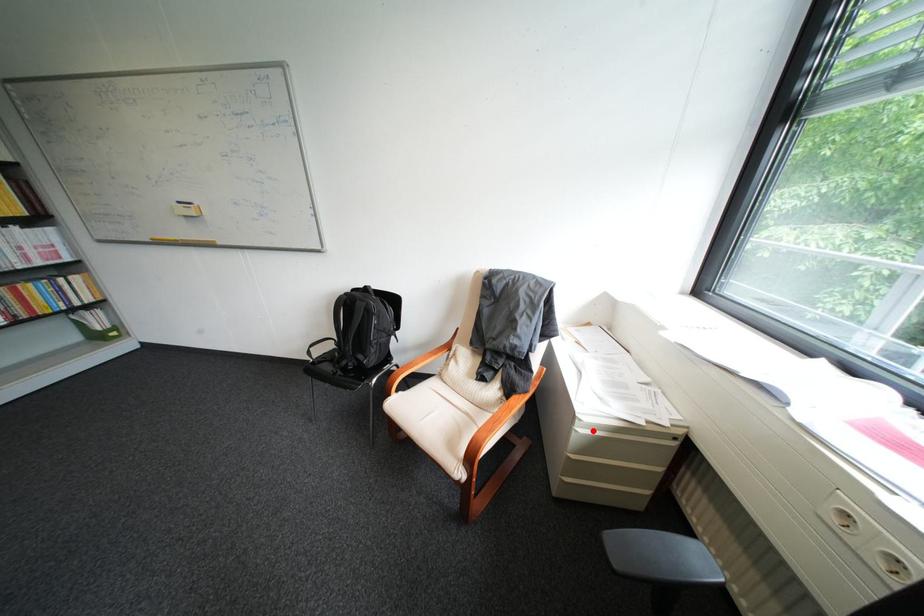
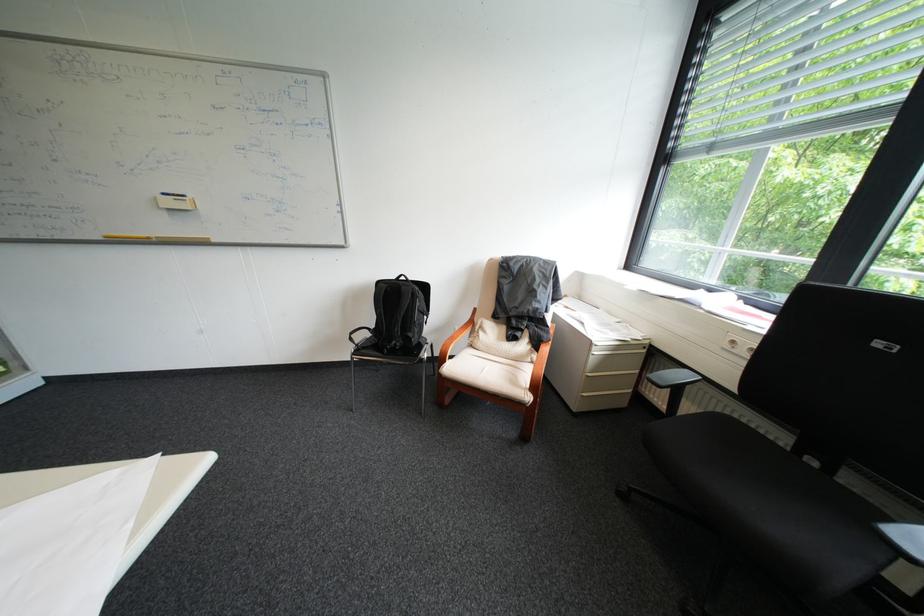
Question: I am providing you with two images of the same scene from different viewpoints. A red point is marked on the first image. At the location where the point appears in image 1, is it still visible in image 2?

Choices:
 (A) Yes
 (B) No

Answer: (A)